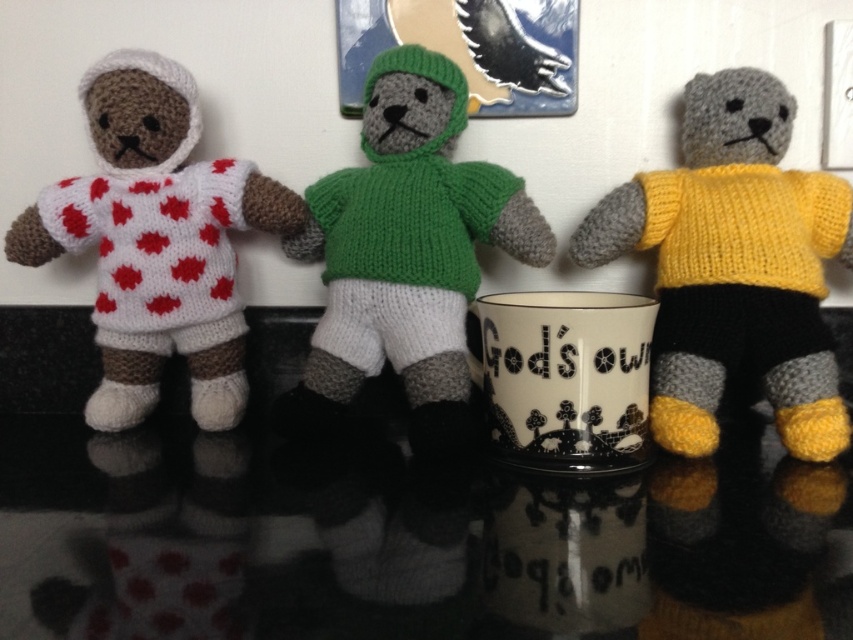
Question: Which point is closer to the camera?

Choices:
 (A) yellow knitted sweater at center
 (B) green knitted sweater at center

Answer: (B)

Question: Which of the following is the farthest from the observer?

Choices:
 (A) (699, 305)
 (B) (256, 189)

Answer: (B)

Question: Which of these objects is positioned farthest from the yellow knitted sweater at center?

Choices:
 (A) white knitted doll at left
 (B) green knitted sweater at center

Answer: (A)

Question: Does green knitted sweater at center appear on the right side of white knitted doll at left?

Choices:
 (A) yes
 (B) no

Answer: (A)

Question: Can you confirm if yellow knitted sweater at center is wider than white knitted doll at left?

Choices:
 (A) no
 (B) yes

Answer: (A)

Question: Is green knitted sweater at center bigger than white knitted doll at left?

Choices:
 (A) yes
 (B) no

Answer: (A)